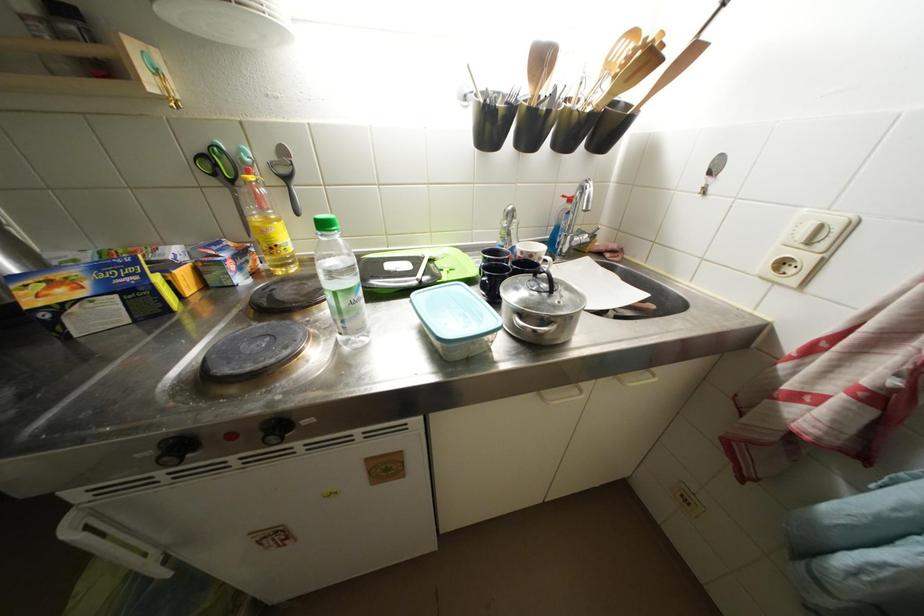
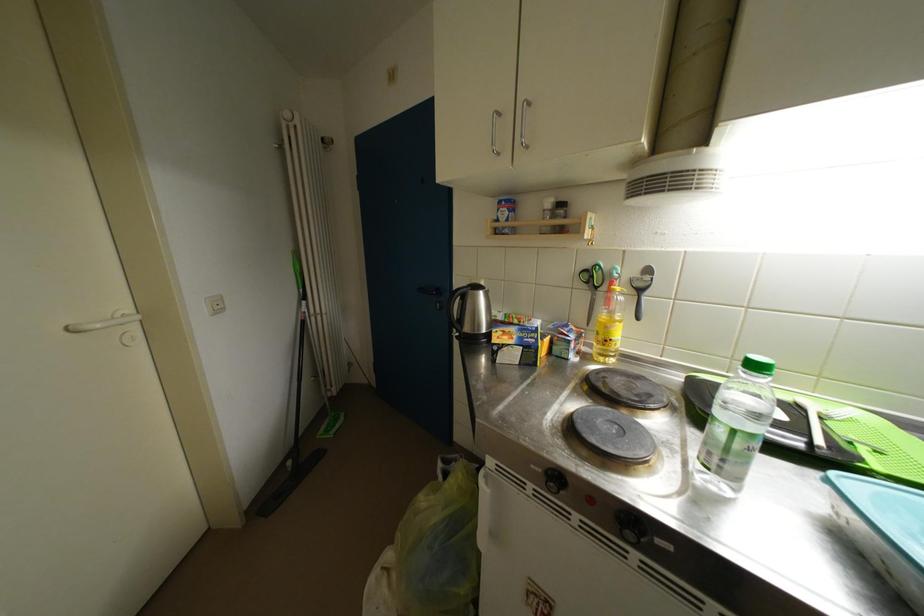
Question: The camera is either moving clockwise (left) or counter-clockwise (right) around the object. The first image is from the beginning of the video and the second image is from the end. Is the camera moving left or right when shooting the video?

Choices:
 (A) Left
 (B) Right

Answer: (B)